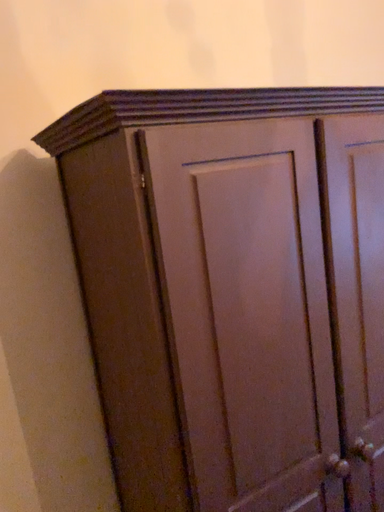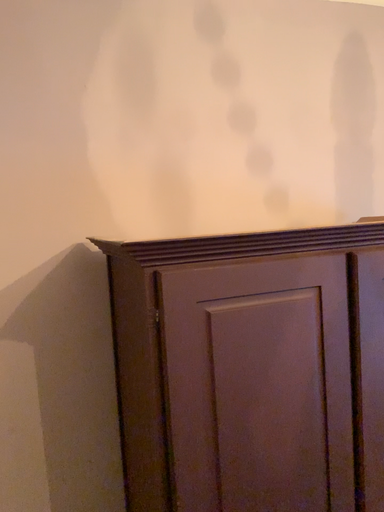
Question: How did the camera likely rotate when shooting the video?

Choices:
 (A) rotated right
 (B) rotated left

Answer: (B)